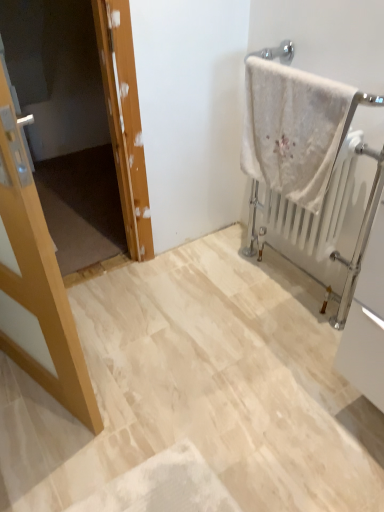
Question: From the image's perspective, is white metallic radiator at right beneath light wood door at left?

Choices:
 (A) no
 (B) yes

Answer: (A)

Question: Are white metallic radiator at right and light wood door at left beside each other?

Choices:
 (A) no
 (B) yes

Answer: (A)

Question: Is white metallic radiator at right shorter than light wood door at left?

Choices:
 (A) yes
 (B) no

Answer: (A)

Question: Does white metallic radiator at right have a smaller size compared to light wood door at left?

Choices:
 (A) yes
 (B) no

Answer: (B)

Question: Is white metallic radiator at right at the left side of light wood door at left?

Choices:
 (A) no
 (B) yes

Answer: (A)

Question: Does point (33, 257) appear closer or farther from the camera than point (264, 103)?

Choices:
 (A) closer
 (B) farther

Answer: (A)

Question: From a real-world perspective, is light wood door at left physically located above or below white fluffy towel at upper right?

Choices:
 (A) below
 (B) above

Answer: (A)

Question: Is light wood door at left to the left or to the right of white fluffy towel at upper right in the image?

Choices:
 (A) left
 (B) right

Answer: (A)

Question: Considering their positions, is light wood door at left located in front of or behind white fluffy towel at upper right?

Choices:
 (A) front
 (B) behind

Answer: (A)

Question: Considering the positions of point (339, 307) and point (13, 195), is point (339, 307) closer or farther from the camera than point (13, 195)?

Choices:
 (A) closer
 (B) farther

Answer: (B)

Question: From the image's perspective, is white metallic radiator at right positioned above or below light wood door at left?

Choices:
 (A) below
 (B) above

Answer: (B)

Question: Considering the positions of white metallic radiator at right and light wood door at left in the image, is white metallic radiator at right taller or shorter than light wood door at left?

Choices:
 (A) short
 (B) tall

Answer: (A)

Question: In the image, is white metallic radiator at right positioned in front of or behind light wood door at left?

Choices:
 (A) behind
 (B) front

Answer: (A)

Question: Based on their sizes in the image, would you say wooden door at left is bigger or smaller than light wood door at left?

Choices:
 (A) small
 (B) big

Answer: (A)

Question: In the image, is wooden door at left positioned in front of or behind light wood door at left?

Choices:
 (A) behind
 (B) front

Answer: (A)